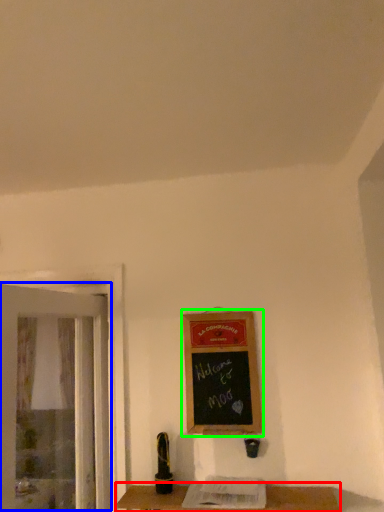
Question: Based on their relative distances, which object is farther from table (highlighted by a red box)? Choose from screen door (highlighted by a blue box) and bulletin board (highlighted by a green box).

Choices:
 (A) screen door
 (B) bulletin board

Answer: (A)